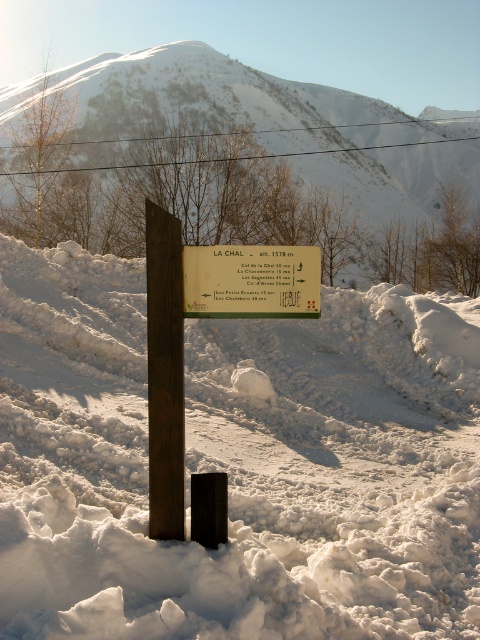
You are a hiker trying to read the directions on the white plastic sign at center. However, the white snow at center is making it difficult. Why is the snow causing this problem?

The white snow at center is in front of the white plastic sign at center, blocking your view of the sign and making it hard to read the directions.

You are a hiker planning to attach a small weatherproof sticker to the tallest object between the rusty wood post at center and the white plastic sign at center. Which object should you choose?

The rusty wood post at center is taller than the white plastic sign at center, so you should attach the sticker to the rusty wood post at center.